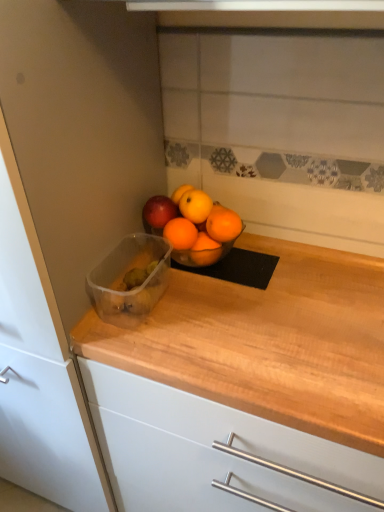
Question: Is orange matte/orange at center a part of wooden countertop at left?

Choices:
 (A) no
 (B) yes

Answer: (A)

Question: From a real-world perspective, is wooden countertop at left beneath orange matte/orange at center?

Choices:
 (A) no
 (B) yes

Answer: (B)

Question: Is wooden countertop at left touching orange matte/orange at center?

Choices:
 (A) yes
 (B) no

Answer: (B)

Question: Is wooden countertop at left facing away from orange matte/orange at center?

Choices:
 (A) no
 (B) yes

Answer: (A)

Question: Is wooden countertop at left not close to orange matte/orange at center?

Choices:
 (A) yes
 (B) no

Answer: (B)

Question: Does wooden countertop at left come in front of orange matte/orange at center?

Choices:
 (A) yes
 (B) no

Answer: (A)

Question: Is transparent plastic container at center in front of wooden countertop at left?

Choices:
 (A) yes
 (B) no

Answer: (B)

Question: Is wooden countertop at left located within transparent plastic container at center?

Choices:
 (A) yes
 (B) no

Answer: (B)

Question: Is the position of transparent plastic container at center more distant than that of wooden countertop at left?

Choices:
 (A) no
 (B) yes

Answer: (B)

Question: Is transparent plastic container at center bigger than wooden countertop at left?

Choices:
 (A) yes
 (B) no

Answer: (B)

Question: Does transparent plastic container at center turn towards wooden countertop at left?

Choices:
 (A) no
 (B) yes

Answer: (A)

Question: Can you confirm if transparent plastic container at center is positioned to the left of wooden countertop at left?

Choices:
 (A) yes
 (B) no

Answer: (B)

Question: Is wooden countertop at left thinner than transparent plastic container at center?

Choices:
 (A) no
 (B) yes

Answer: (A)